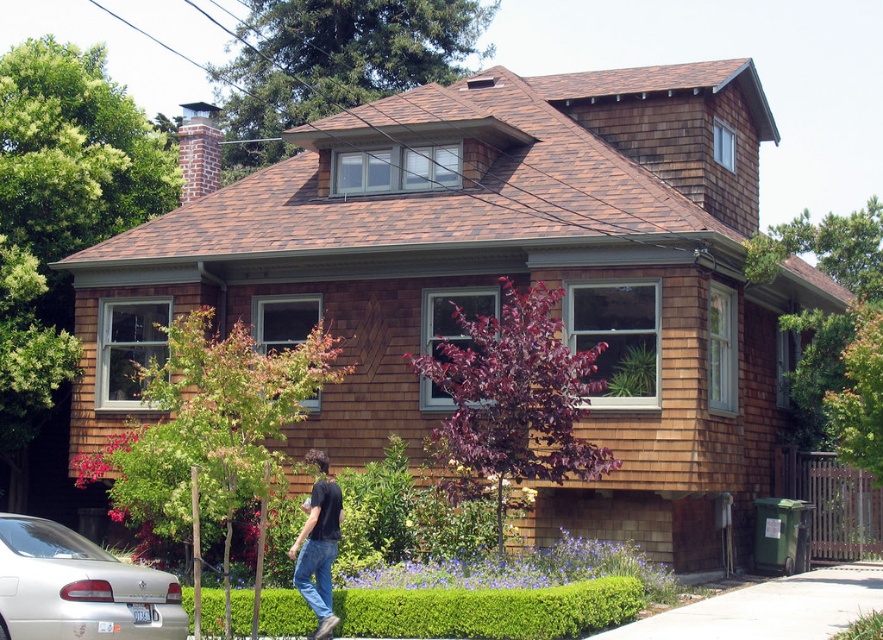
You are standing in front of the house and notice a silver metallic car at lower left and a green leafy hedge at lower center. Which object is closer to you?

The green leafy hedge at lower center is closer to you because the silver metallic car at lower left is behind it.

You are standing in front of the house and see the green leafy hedge at lower center and the black cotton shirt at lower center. Which object is wider?

The green leafy hedge at lower center is wider than the black cotton shirt at lower center.

You are standing in front of the house and notice a silver metallic car at lower left and a black cotton shirt at lower center. Which object is taller?

The black cotton shirt at lower center is taller than the silver metallic car at lower left.